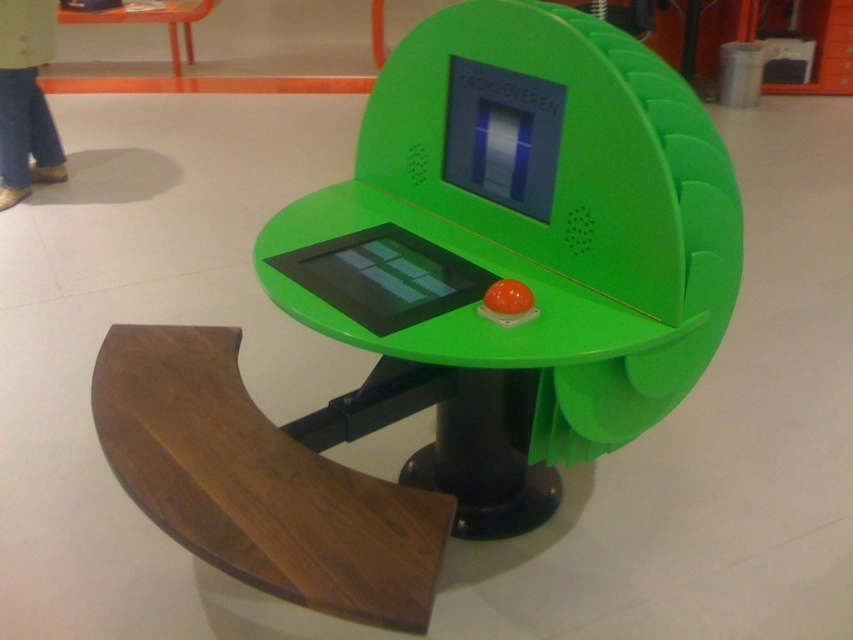
Question: In this image, where is walnut wood armrest at lower left located relative to orange glossy table at upper left?

Choices:
 (A) above
 (B) below

Answer: (B)

Question: Is walnut wood armrest at lower left to the right of orange glossy table at upper left from the viewer's perspective?

Choices:
 (A) yes
 (B) no

Answer: (A)

Question: Is walnut wood armrest at lower left thinner than orange glossy table at upper left?

Choices:
 (A) no
 (B) yes

Answer: (B)